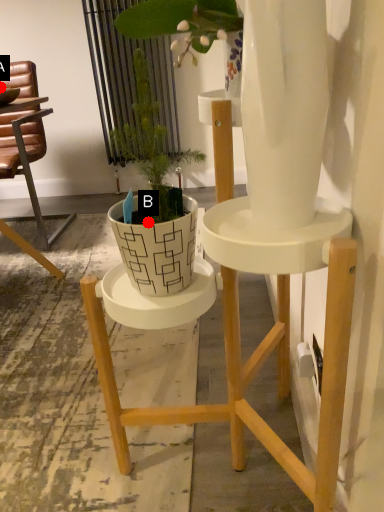
Question: Two points are circled on the image, labeled by A and B beside each circle. Which point is closer to the camera?

Choices:
 (A) A is closer
 (B) B is closer

Answer: (B)